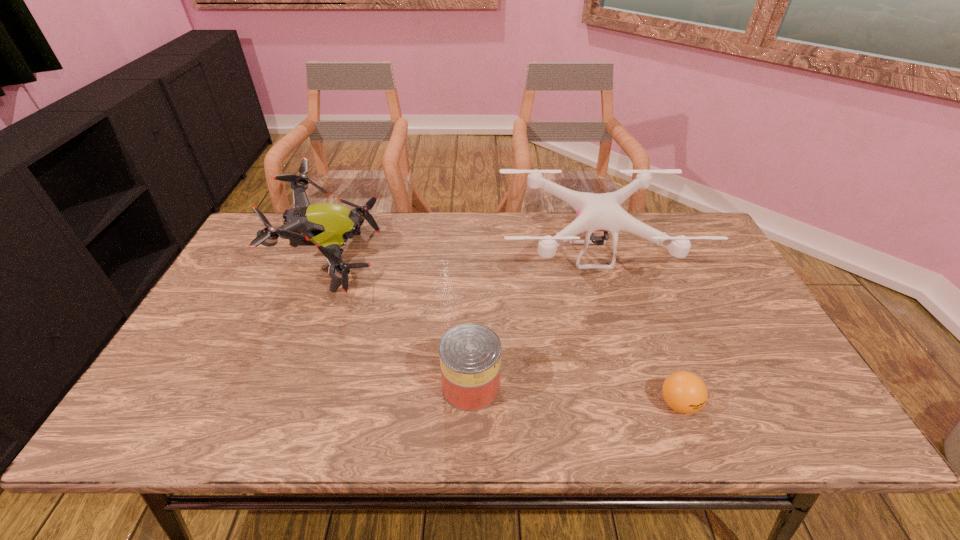
Locate an element on the screen. The width and height of the screenshot is (960, 540). free point between the second tallest object and the can is located at coordinates (531, 321).

Find the location of a particular element. This screenshot has width=960, height=540. vacant point located between the tallest object and the ping-pong ball is located at coordinates (506, 332).

Identify which object is located as the second nearest to the shorter drone. Please provide its 2D coordinates. Your answer should be formatted as a tuple, i.e. [(x, y)], where the tuple contains the x and y coordinates of a point satisfying the conditions above.

[(684, 392)]

Where is `object that is the third closest to the shortest object`? The height and width of the screenshot is (540, 960). object that is the third closest to the shortest object is located at coordinates (328, 226).

Find the location of `vacant region that satisfies the following two spatial constraints: 1. on the top of the right drone; 2. on the front-facing side of the left drone`. vacant region that satisfies the following two spatial constraints: 1. on the top of the right drone; 2. on the front-facing side of the left drone is located at coordinates (592, 259).

This screenshot has width=960, height=540. I want to click on vacant area that satisfies the following two spatial constraints: 1. on the top of the third shortest object; 2. on the front-facing side of the left drone, so click(x=592, y=259).